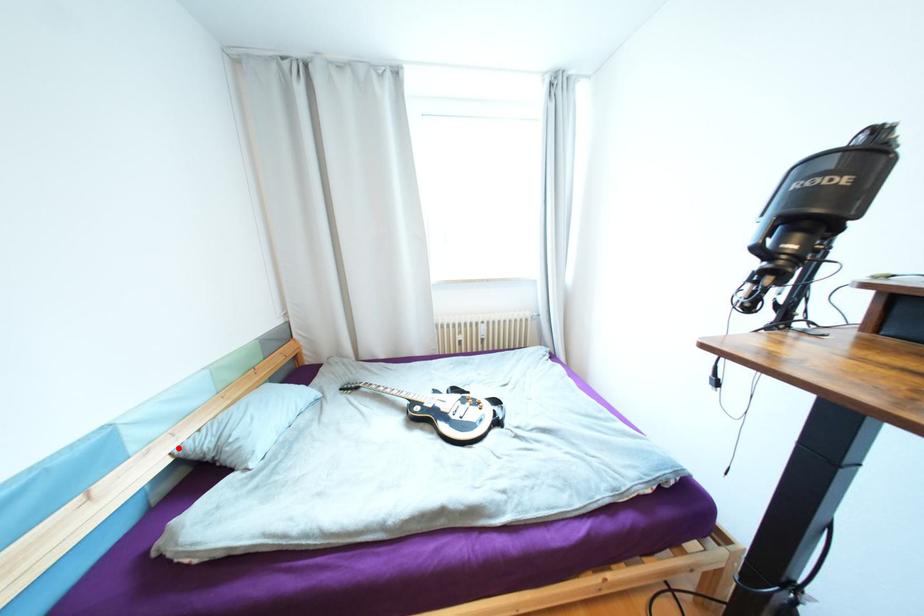
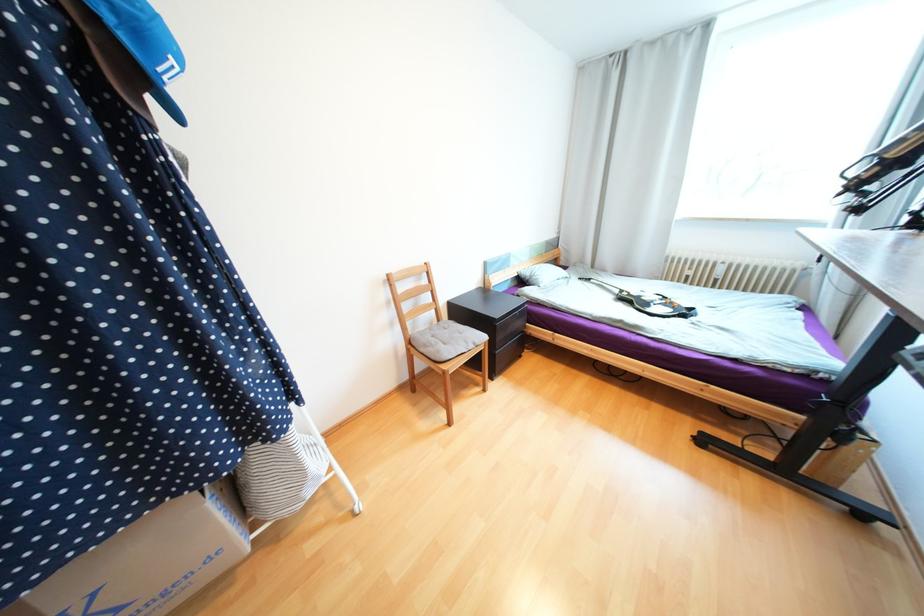
Question: I am providing you with two images of the same scene from different viewpoints. Image1 has a red point marked. In image2, the corresponding 3D location appears at what relative position? Reply with the corresponding letter.

Choices:
 (A) Closer
 (B) Farther

Answer: (A)